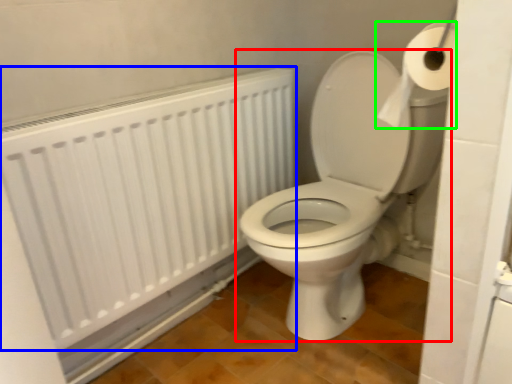
Question: Estimate the real-world distances between objects in this image. Which object is farther from toilet (highlighted by a red box), radiator (highlighted by a blue box) or toilet paper (highlighted by a green box)?

Choices:
 (A) radiator
 (B) toilet paper

Answer: (B)